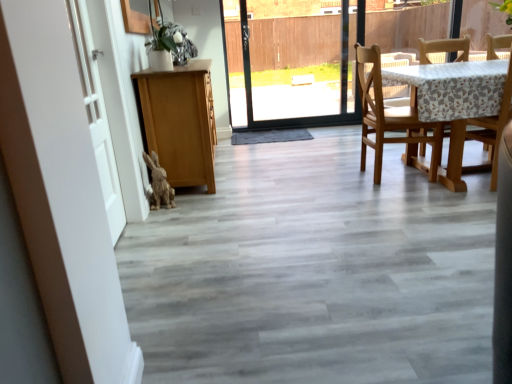
Question: From a real-world perspective, is wooden chair at right, the first chair in the right-to-left sequence, located beneath white matte barn door at left?

Choices:
 (A) no
 (B) yes

Answer: (B)

Question: Is wooden chair at right, the first chair in the right-to-left sequence, bigger than white matte barn door at left?

Choices:
 (A) no
 (B) yes

Answer: (A)

Question: Is wooden chair at right, the 2th chair viewed from the left, oriented away from white matte barn door at left?

Choices:
 (A) no
 (B) yes

Answer: (A)

Question: Does wooden chair at right, the 2th chair viewed from the left, have a greater height compared to white matte barn door at left?

Choices:
 (A) no
 (B) yes

Answer: (A)

Question: Is wooden chair at right, the first chair in the right-to-left sequence, closer to camera compared to white matte barn door at left?

Choices:
 (A) no
 (B) yes

Answer: (A)

Question: Does wooden chair at right, the first chair in the right-to-left sequence, appear on the left side of white matte barn door at left?

Choices:
 (A) yes
 (B) no

Answer: (B)

Question: Is fuzzy brown rabbit at lower left next to light brown wooden chair at right, which is the 2th chair from right to left, and touching it?

Choices:
 (A) no
 (B) yes

Answer: (A)

Question: Is fuzzy brown rabbit at lower left closer to the viewer compared to light brown wooden chair at right, which is the 1th chair in left-to-right order?

Choices:
 (A) yes
 (B) no

Answer: (A)

Question: Is fuzzy brown rabbit at lower left outside light brown wooden chair at right, which is the 2th chair from right to left?

Choices:
 (A) no
 (B) yes

Answer: (B)

Question: Is fuzzy brown rabbit at lower left to the left of light brown wooden chair at right, which is the 1th chair in left-to-right order, from the viewer's perspective?

Choices:
 (A) no
 (B) yes

Answer: (B)

Question: From a real-world perspective, does fuzzy brown rabbit at lower left sit lower than light brown wooden chair at right, which is the 2th chair from right to left?

Choices:
 (A) yes
 (B) no

Answer: (A)

Question: Is fuzzy brown rabbit at lower left positioned with its back to light brown wooden chair at right, which is the 2th chair from right to left?

Choices:
 (A) no
 (B) yes

Answer: (A)

Question: Is white matte barn door at left completely or partially outside of white matte door at left?

Choices:
 (A) yes
 (B) no

Answer: (A)